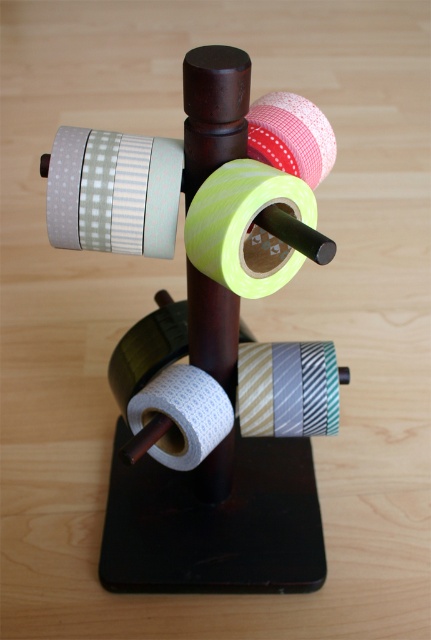
You are organizing a craft station and need to know which tape is narrower. You see the matte green and white checkered tape at upper left and the white textured toilet paper at center. Which one has a smaller width?

The matte green and white checkered tape at upper left has a lesser width compared to the white textured toilet paper at center, so it is narrower.

You are a craftsperson holding a 12 inch ruler. You want to measure the distance from your camera to the point at coordinates point (x=61, y=129). Can you determine if the ruler is long enough to reach that point?

The distance of point (x=61, y=129) from camera is 30.31 inches, so the ruler is only 12 inches long and cannot reach the point.